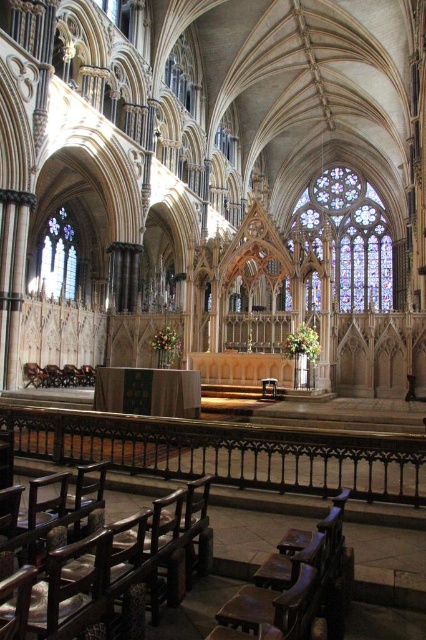
Is stained glass at upper right wider than clear glass window at left?

Correct, the width of stained glass at upper right exceeds that of clear glass window at left.

Does stained glass at upper right have a lesser height compared to clear glass window at left?

In fact, stained glass at upper right may be taller than clear glass window at left.

Identify the location of stained glass at upper right. The height and width of the screenshot is (640, 426). (350, 236).

Does stained glass at upper right appear under wooden polished chair at lower center?

No, stained glass at upper right is not below wooden polished chair at lower center.

Looking at this image, does stained glass at upper right come in front of wooden polished chair at lower center?

No, stained glass at upper right is behind wooden polished chair at lower center.

Measure the distance between point (368,280) and camera.

They are 134.77 meters apart.

Identify the location of stained glass at upper right. This screenshot has width=426, height=640. (350, 236).

Between point (143, 612) and point (66, 285), which one is positioned behind?

The point (66, 285) is more distant.

Who is positioned more to the right, dark brown wood chair at lower left or clear glass window at left?

dark brown wood chair at lower left is more to the right.

Is point (138, 579) positioned before point (54, 244)?

That is True.

Image resolution: width=426 pixels, height=640 pixels. Identify the location of dark brown wood chair at lower left. (112, 568).